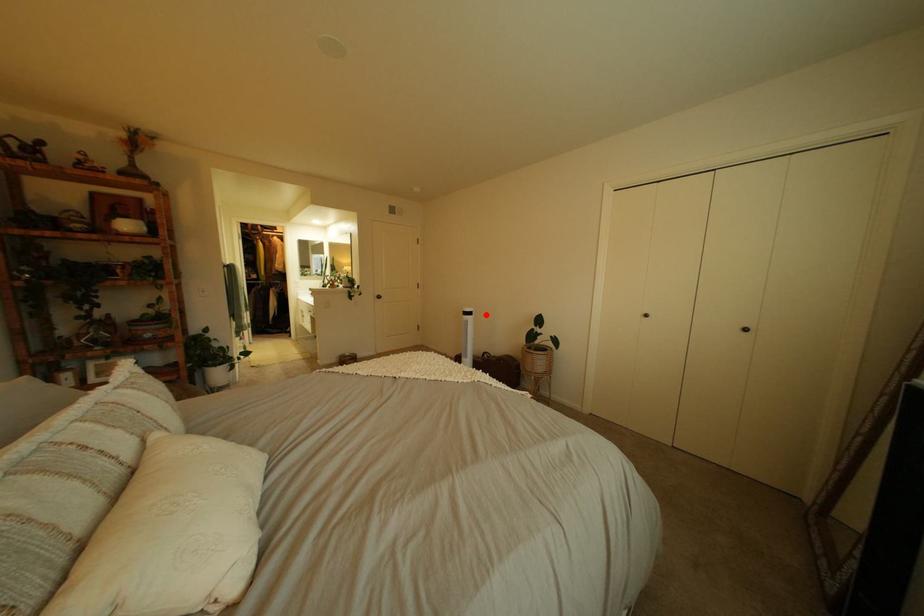
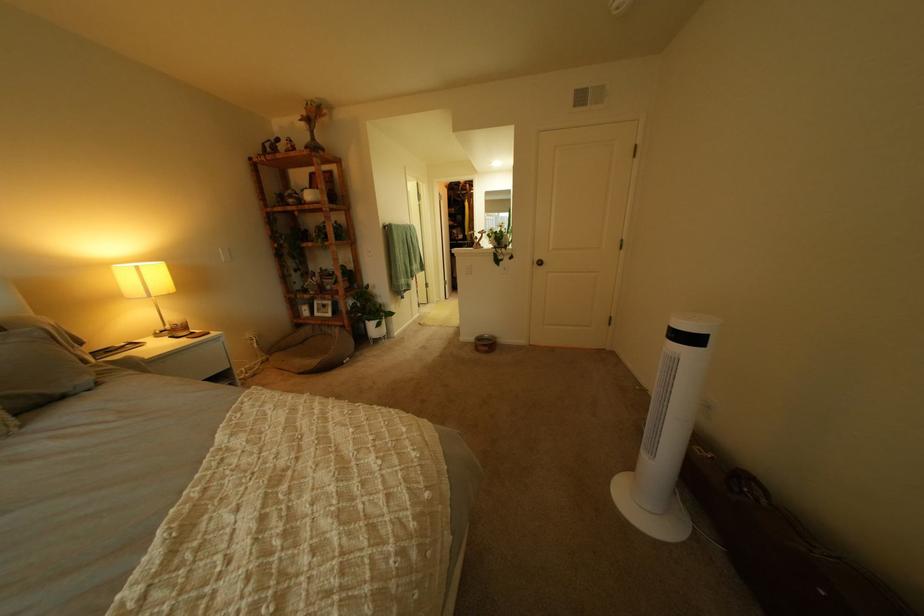
Where in the second image is the point corresponding to the highlighted location from the first image?

(710, 341)